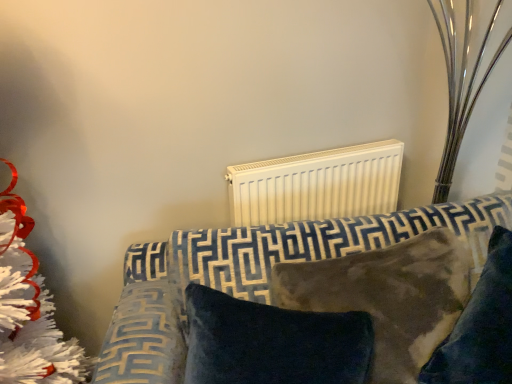
Where is `white matte radiator at upper center`? white matte radiator at upper center is located at coordinates (317, 185).

What is the approximate height of velvet dark blue pillow at center, positioned as the 1th pillow in left-to-right order?

velvet dark blue pillow at center, positioned as the 1th pillow in left-to-right order, is 37.24 centimeters in height.

You are a GUI agent. You are given a task and a screenshot of the screen. Output one action in this format:
    pyautogui.click(x=<x>, y=<y>)
    Task: Click on the velvet-patterned sofa at center
    Image resolution: width=512 pixels, height=384 pixels.
    Given the screenshot: What is the action you would take?
    pyautogui.click(x=262, y=268)

What do you see at coordinates (480, 327) in the screenshot?
I see `velvety brown pillow at center, which appears as the first pillow when viewed from the right` at bounding box center [480, 327].

Find the location of `white matte radiator at upper center`. white matte radiator at upper center is located at coordinates (317, 185).

Between velvet dark blue pillow at center, positioned as the 1th pillow in left-to-right order, and velvet-patterned sofa at center, which one has larger width?

velvet-patterned sofa at center is wider.

Does velvet dark blue pillow at center, positioned as the 1th pillow in left-to-right order, turn towards velvet-patterned sofa at center?

Yes, velvet dark blue pillow at center, positioned as the 1th pillow in left-to-right order, faces towards velvet-patterned sofa at center.

Considering the relative sizes of velvet dark blue pillow at center, marked as the 2th pillow in a right-to-left arrangement, and velvet-patterned sofa at center in the image provided, is velvet dark blue pillow at center, marked as the 2th pillow in a right-to-left arrangement, taller than velvet-patterned sofa at center?

In fact, velvet dark blue pillow at center, marked as the 2th pillow in a right-to-left arrangement, may be shorter than velvet-patterned sofa at center.

Is velvety brown pillow at center, which appears as the first pillow when viewed from the right, smaller than velvet-patterned sofa at center?

Yes.

Could you tell me if velvety brown pillow at center, the second pillow in the left-to-right sequence, is facing velvet-patterned sofa at center?

Yes, velvety brown pillow at center, the second pillow in the left-to-right sequence, is aimed at velvet-patterned sofa at center.

Can you confirm if velvety brown pillow at center, which appears as the first pillow when viewed from the right, is shorter than velvet-patterned sofa at center?

Correct, velvety brown pillow at center, which appears as the first pillow when viewed from the right, is not as tall as velvet-patterned sofa at center.

From a real-world perspective, is velvety brown pillow at center, which appears as the first pillow when viewed from the right, over velvet-patterned sofa at center?

Yes, from a real-world perspective, velvety brown pillow at center, which appears as the first pillow when viewed from the right, is on top of velvet-patterned sofa at center.

Can we say velvet-patterned sofa at center lies outside white matte radiator at upper center?

Yes, velvet-patterned sofa at center is not within white matte radiator at upper center.

Is velvet-patterned sofa at center in front of or behind white matte radiator at upper center in the image?

velvet-patterned sofa at center is in front of white matte radiator at upper center.

Considering the sizes of objects velvet-patterned sofa at center and white matte radiator at upper center in the image provided, who is shorter, velvet-patterned sofa at center or white matte radiator at upper center?

Standing shorter between the two is white matte radiator at upper center.

From the image's perspective, which is above, velvet dark blue pillow at center, positioned as the 1th pillow in left-to-right order, or velvety brown pillow at center, which appears as the first pillow when viewed from the right?

From the image's view, velvety brown pillow at center, which appears as the first pillow when viewed from the right, is above.

Is point (247, 305) positioned behind point (473, 379)?

Yes, point (247, 305) is behind point (473, 379).

From a real-world perspective, is velvet dark blue pillow at center, marked as the 2th pillow in a right-to-left arrangement, located beneath velvety brown pillow at center, which appears as the first pillow when viewed from the right?

Indeed, from a real-world perspective, velvet dark blue pillow at center, marked as the 2th pillow in a right-to-left arrangement, is positioned beneath velvety brown pillow at center, which appears as the first pillow when viewed from the right.

Considering the relative sizes of velvet dark blue pillow at center, positioned as the 1th pillow in left-to-right order, and velvety brown pillow at center, which appears as the first pillow when viewed from the right, in the image provided, is velvet dark blue pillow at center, positioned as the 1th pillow in left-to-right order, bigger than velvety brown pillow at center, which appears as the first pillow when viewed from the right,?

Actually, velvet dark blue pillow at center, positioned as the 1th pillow in left-to-right order, might be smaller than velvety brown pillow at center, which appears as the first pillow when viewed from the right.

Which object is more forward, white matte radiator at upper center or velvet dark blue pillow at center, marked as the 2th pillow in a right-to-left arrangement?

Positioned in front is velvet dark blue pillow at center, marked as the 2th pillow in a right-to-left arrangement.

In terms of height, does white matte radiator at upper center look taller or shorter compared to velvet dark blue pillow at center, marked as the 2th pillow in a right-to-left arrangement?

In the image, white matte radiator at upper center appears to be shorter than velvet dark blue pillow at center, marked as the 2th pillow in a right-to-left arrangement.

Is velvet dark blue pillow at center, positioned as the 1th pillow in left-to-right order, further to the viewer compared to white matte radiator at upper center?

That is False.

Based on the photo, is velvet dark blue pillow at center, positioned as the 1th pillow in left-to-right order, facing away from white matte radiator at upper center?

Yes, velvet dark blue pillow at center, positioned as the 1th pillow in left-to-right order, is positioned with its back facing white matte radiator at upper center.

This screenshot has height=384, width=512. I want to click on radiator above the velvet dark blue pillow at center, marked as the 2th pillow in a right-to-left arrangement (from a real-world perspective), so click(317, 185).

Considering the relative positions of velvety brown pillow at center, which appears as the first pillow when viewed from the right, and velvet dark blue pillow at center, marked as the 2th pillow in a right-to-left arrangement, in the image provided, is velvety brown pillow at center, which appears as the first pillow when viewed from the right, to the left of velvet dark blue pillow at center, marked as the 2th pillow in a right-to-left arrangement, from the viewer's perspective?

In fact, velvety brown pillow at center, which appears as the first pillow when viewed from the right, is to the right of velvet dark blue pillow at center, marked as the 2th pillow in a right-to-left arrangement.

Measure the distance from velvety brown pillow at center, which appears as the first pillow when viewed from the right, to velvet dark blue pillow at center, positioned as the 1th pillow in left-to-right order.

velvety brown pillow at center, which appears as the first pillow when viewed from the right, is 12.93 inches away from velvet dark blue pillow at center, positioned as the 1th pillow in left-to-right order.

Where is `pillow on the left of velvety brown pillow at center, the second pillow in the left-to-right sequence`? pillow on the left of velvety brown pillow at center, the second pillow in the left-to-right sequence is located at coordinates (273, 343).

Identify the location of furniture on the right of the velvet dark blue pillow at center, positioned as the 1th pillow in left-to-right order. tap(262, 268).

This screenshot has width=512, height=384. Identify the location of furniture beneath the velvety brown pillow at center, which appears as the first pillow when viewed from the right (from a real-world perspective). (262, 268).

Which object lies further to the anchor point velvet-patterned sofa at center, velvety brown pillow at center, the second pillow in the left-to-right sequence, or white matte radiator at upper center?

white matte radiator at upper center is further to velvet-patterned sofa at center.

Considering their positions, is velvet dark blue pillow at center, positioned as the 1th pillow in left-to-right order, positioned further to velvet-patterned sofa at center than velvety brown pillow at center, which appears as the first pillow when viewed from the right?

velvety brown pillow at center, which appears as the first pillow when viewed from the right, is positioned further to the anchor velvet-patterned sofa at center.

Considering their positions, is white matte radiator at upper center positioned further to velvety brown pillow at center, which appears as the first pillow when viewed from the right, than velvet-patterned sofa at center?

white matte radiator at upper center is further to velvety brown pillow at center, which appears as the first pillow when viewed from the right.

Looking at the image, which one is located closer to velvety brown pillow at center, the second pillow in the left-to-right sequence, velvet-patterned sofa at center or white matte radiator at upper center?

Among the two, velvet-patterned sofa at center is located nearer to velvety brown pillow at center, the second pillow in the left-to-right sequence.

Looking at this image, when comparing their distances from velvety brown pillow at center, which appears as the first pillow when viewed from the right, does velvet dark blue pillow at center, positioned as the 1th pillow in left-to-right order, or velvet-patterned sofa at center seem further?

The object further to velvety brown pillow at center, which appears as the first pillow when viewed from the right, is velvet-patterned sofa at center.

Which object lies nearer to the anchor point velvety brown pillow at center, the second pillow in the left-to-right sequence, velvet dark blue pillow at center, positioned as the 1th pillow in left-to-right order, or white matte radiator at upper center?

velvet dark blue pillow at center, positioned as the 1th pillow in left-to-right order, is closer to velvety brown pillow at center, the second pillow in the left-to-right sequence.

From the image, which object appears to be farther from velvet dark blue pillow at center, marked as the 2th pillow in a right-to-left arrangement, velvet-patterned sofa at center or velvety brown pillow at center, the second pillow in the left-to-right sequence?

velvety brown pillow at center, the second pillow in the left-to-right sequence.

When comparing their distances from white matte radiator at upper center, does velvet dark blue pillow at center, marked as the 2th pillow in a right-to-left arrangement, or velvet-patterned sofa at center seem closer?

Based on the image, velvet-patterned sofa at center appears to be nearer to white matte radiator at upper center.

Find the location of `furniture located between velvet dark blue pillow at center, positioned as the 1th pillow in left-to-right order, and velvety brown pillow at center, which appears as the first pillow when viewed from the right, in the left-right direction`. furniture located between velvet dark blue pillow at center, positioned as the 1th pillow in left-to-right order, and velvety brown pillow at center, which appears as the first pillow when viewed from the right, in the left-right direction is located at coordinates (x=262, y=268).

The height and width of the screenshot is (384, 512). I want to click on pillow located between velvety brown pillow at center, which appears as the first pillow when viewed from the right, and white matte radiator at upper center in the depth direction, so click(273, 343).